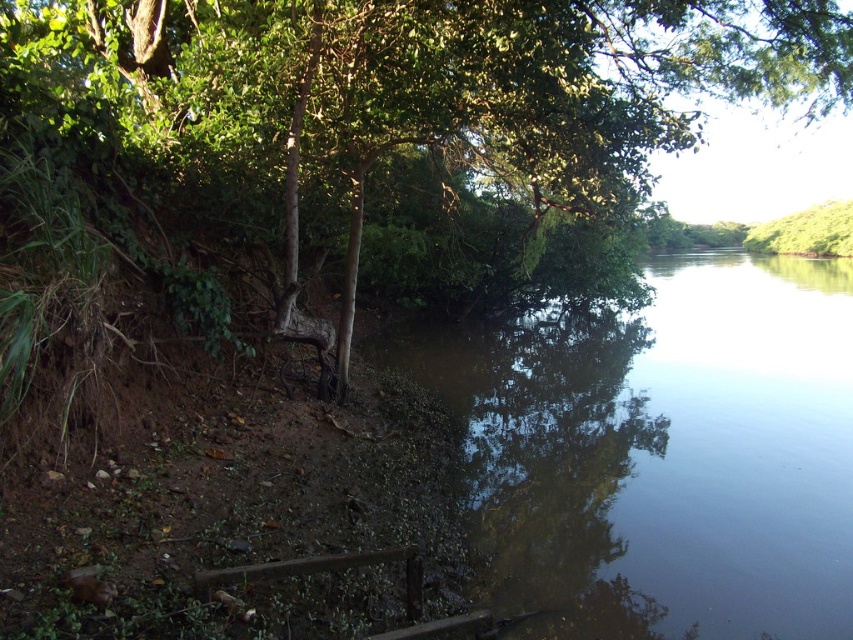
Question: Which point is farther to the camera?

Choices:
 (A) brown murky water at center
 (B) green leafy tree at left

Answer: (B)

Question: Which point is closer to the camera?

Choices:
 (A) green leafy tree at left
 (B) brown murky water at center

Answer: (B)

Question: Does brown murky water at center lie behind green leafy tree at left?

Choices:
 (A) no
 (B) yes

Answer: (A)

Question: Is the position of brown murky water at center less distant than that of green leafy tree at left?

Choices:
 (A) no
 (B) yes

Answer: (B)

Question: Does brown murky water at center appear under green leafy tree at left?

Choices:
 (A) yes
 (B) no

Answer: (A)

Question: Which point appears farthest from the camera in this image?

Choices:
 (A) (527, 579)
 (B) (326, 173)

Answer: (B)